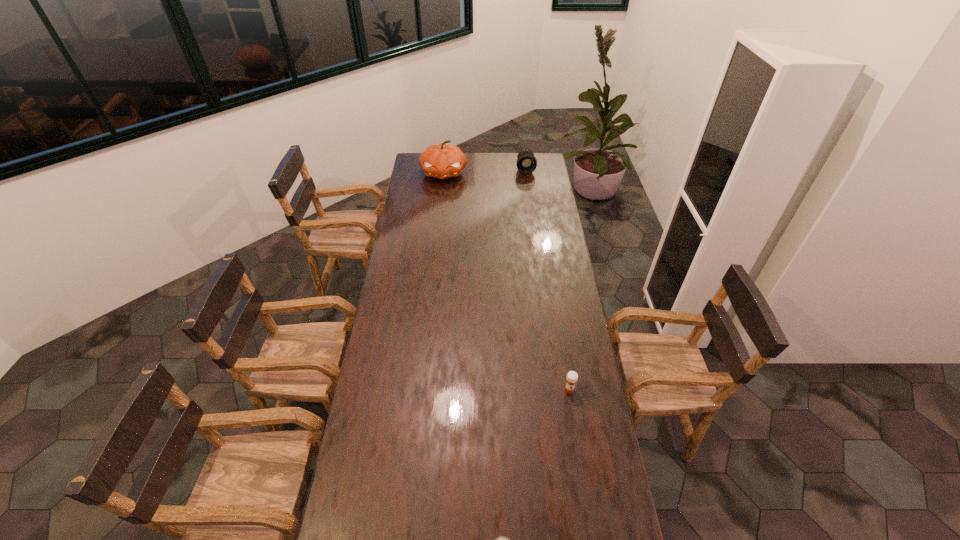
At what (x,y) coordinates should I click in order to perform the action: click on object at the left edge. Please return your answer as a coordinate pair (x, y). Looking at the image, I should click on (442, 161).

Where is `telephoto lens that is at the right edge`? telephoto lens that is at the right edge is located at coordinates (526, 163).

The width and height of the screenshot is (960, 540). I want to click on medicine that is at the right edge, so click(572, 377).

Locate an element on the screen. object that is at the far left corner is located at coordinates (442, 161).

Locate an element on the screen. The height and width of the screenshot is (540, 960). object at the far right corner is located at coordinates (526, 163).

Locate an element on the screen. This screenshot has height=540, width=960. vacant space at the left edge of the desktop is located at coordinates (408, 400).

In the image, there is a desktop. At what (x,y) coordinates should I click in order to perform the action: click on vacant region at the right edge. Please return your answer as a coordinate pair (x, y). This screenshot has width=960, height=540. Looking at the image, I should click on (546, 311).

I want to click on empty location between the right medicine and the telephoto lens, so click(x=547, y=280).

Image resolution: width=960 pixels, height=540 pixels. I want to click on free space between the pumpkin and the right medicine, so click(506, 281).

What are the coordinates of `vacant area that lies between the telephoto lens and the tallest object` in the screenshot? It's located at (485, 171).